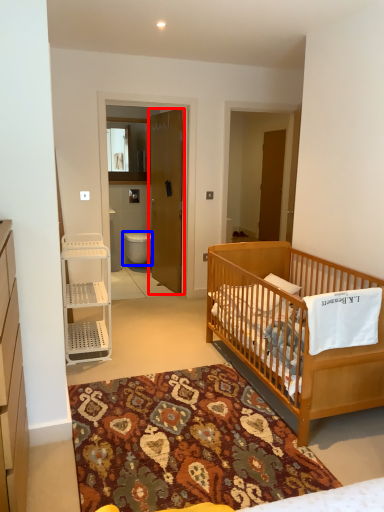
Question: Which point is further to the camera, door (highlighted by a red box) or toilet (highlighted by a blue box)?

Choices:
 (A) door
 (B) toilet

Answer: (B)